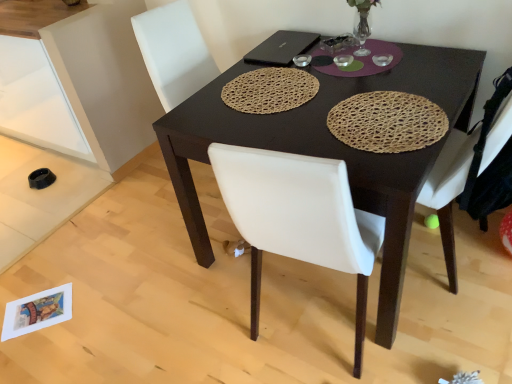
The height and width of the screenshot is (384, 512). Describe the element at coordinates (471, 169) in the screenshot. I see `white leather chair at right` at that location.

Find the location of a particular element. Image resolution: width=512 pixels, height=384 pixels. woven straw placemat at center, the 2th mat when ordered from left to right is located at coordinates [x=387, y=122].

Describe the element at coordinates (36, 79) in the screenshot. I see `matte white cabinet at lower left` at that location.

This screenshot has width=512, height=384. Identify the location of dark brown wooden desk at center. (329, 149).

The width and height of the screenshot is (512, 384). What are the coordinates of `cabinetry behind the white leather chair at right` in the screenshot? It's located at coord(36,79).

Between matte white cabinet at lower left and white leather chair at right, which one appears on the right side from the viewer's perspective?

Positioned to the right is white leather chair at right.

Is white leather chair at right inside matte white cabinet at lower left?

Actually, white leather chair at right is outside matte white cabinet at lower left.

Considering the relative sizes of matte white cabinet at lower left and white leather chair at right in the image provided, is matte white cabinet at lower left thinner than white leather chair at right?

In fact, matte white cabinet at lower left might be wider than white leather chair at right.

Considering the positions of point (313, 97) and point (433, 182), is point (313, 97) closer or farther from the camera than point (433, 182)?

Clearly, point (313, 97) is more distant from the camera than point (433, 182).

Looking at this image, can you confirm if woven brown placemat at center, the 2th mat from the right, is thinner than white leather chair at right?

Yes.

Is woven brown placemat at center, the 1th mat positioned from the left, to the left or to the right of white leather chair at right in the image?

Based on their positions, woven brown placemat at center, the 1th mat positioned from the left, is located to the left of white leather chair at right.

Is there a large distance between matte white cabinet at lower left and woven straw placemat at center, marked as the first mat in a right-to-left arrangement?

Yes, matte white cabinet at lower left is far from woven straw placemat at center, marked as the first mat in a right-to-left arrangement.

Is matte white cabinet at lower left spatially inside woven straw placemat at center, marked as the first mat in a right-to-left arrangement, or outside of it?

matte white cabinet at lower left is not inside woven straw placemat at center, marked as the first mat in a right-to-left arrangement, it's outside.

Is matte white cabinet at lower left positioned behind woven straw placemat at center, marked as the first mat in a right-to-left arrangement?

Yes, the depth of matte white cabinet at lower left is greater than that of woven straw placemat at center, marked as the first mat in a right-to-left arrangement.

From a real-world perspective, is matte white cabinet at lower left over woven straw placemat at center, marked as the first mat in a right-to-left arrangement?

Incorrect, from a real-world perspective, matte white cabinet at lower left is lower than woven straw placemat at center, marked as the first mat in a right-to-left arrangement.

From the image's perspective, which one is positioned lower, woven brown placemat at center, the 1th mat positioned from the left, or woven straw placemat at center, the 2th mat when ordered from left to right?

woven straw placemat at center, the 2th mat when ordered from left to right, from the image's perspective.

From the picture: Is woven brown placemat at center, the 1th mat positioned from the left, turned away from woven straw placemat at center, marked as the first mat in a right-to-left arrangement?

That's not correct — woven brown placemat at center, the 1th mat positioned from the left, is not looking away from woven straw placemat at center, marked as the first mat in a right-to-left arrangement.

Are woven brown placemat at center, the 2th mat from the right, and woven straw placemat at center, the 2th mat when ordered from left to right, beside each other?

They are not placed beside each other.

Based on the photo, do you think woven brown placemat at center, the 1th mat positioned from the left, is within woven straw placemat at center, the 2th mat when ordered from left to right, or outside of it?

woven brown placemat at center, the 1th mat positioned from the left, is located beyond the bounds of woven straw placemat at center, the 2th mat when ordered from left to right.

Does point (33, 93) come behind point (301, 44)?

Yes, point (33, 93) is behind point (301, 44).

Does matte white cabinet at lower left have a lesser width compared to black matte laptop at upper center?

In fact, matte white cabinet at lower left might be wider than black matte laptop at upper center.

Is black matte laptop at upper center at the back of matte white cabinet at lower left?

No, black matte laptop at upper center is not at the back of matte white cabinet at lower left.

Can you confirm if matte white cabinet at lower left is bigger than black matte laptop at upper center?

Correct, matte white cabinet at lower left is larger in size than black matte laptop at upper center.

Does point (391, 157) appear closer or farther from the camera than point (464, 140)?

Clearly, point (391, 157) is closer to the camera than point (464, 140).

Is dark brown wooden desk at center to the left or to the right of white leather chair at right in the image?

From the image, it's evident that dark brown wooden desk at center is to the left of white leather chair at right.

From the image's perspective, is dark brown wooden desk at center over white leather chair at right?

No, from the image's perspective, dark brown wooden desk at center is not above white leather chair at right.

Considering the sizes of dark brown wooden desk at center and white leather chair at right in the image, is dark brown wooden desk at center bigger or smaller than white leather chair at right?

Considering their sizes, dark brown wooden desk at center takes up more space than white leather chair at right.

Considering their positions, is black matte laptop at upper center located in front of or behind matte white cabinet at lower left?

black matte laptop at upper center is positioned closer to the viewer than matte white cabinet at lower left.

Considering the points (271, 58) and (46, 14), which point is behind, point (271, 58) or point (46, 14)?

The point (46, 14) is behind.

Where is `cabinetry directly beneath the black matte laptop at upper center (from a real-world perspective)`? This screenshot has height=384, width=512. cabinetry directly beneath the black matte laptop at upper center (from a real-world perspective) is located at coordinates (36, 79).

Considering the sizes of objects black matte laptop at upper center and matte white cabinet at lower left in the image provided, who is shorter, black matte laptop at upper center or matte white cabinet at lower left?

Standing shorter between the two is black matte laptop at upper center.

You are a GUI agent. You are given a task and a screenshot of the screen. Output one action in this format:
    pyautogui.click(x=<x>, y=<y>)
    Task: Click on the cabinetry behind the white leather chair at right
    
    Given the screenshot: What is the action you would take?
    pyautogui.click(x=36, y=79)

Starting from the white leather chair at right, which mat is the 2nd one to the left? Please provide its 2D coordinates.

[(270, 90)]

Based on their spatial positions, is black matte laptop at upper center or woven straw placemat at center, the 2th mat when ordered from left to right, further from dark brown wooden desk at center?

black matte laptop at upper center.

Based on their spatial positions, is woven straw placemat at center, marked as the first mat in a right-to-left arrangement, or matte white cabinet at lower left closer to black matte laptop at upper center?

woven straw placemat at center, marked as the first mat in a right-to-left arrangement, is closer to black matte laptop at upper center.

Looking at the image, which one is located further to woven brown placemat at center, the 1th mat positioned from the left, black matte laptop at upper center or dark brown wooden desk at center?

Among the two, dark brown wooden desk at center is located further to woven brown placemat at center, the 1th mat positioned from the left.

When comparing their distances from dark brown wooden desk at center, does matte white cabinet at lower left or woven straw placemat at center, the 2th mat when ordered from left to right, seem further?

Among the two, matte white cabinet at lower left is located further to dark brown wooden desk at center.

Considering their positions, is matte white cabinet at lower left positioned further to woven brown placemat at center, the 2th mat from the right, than dark brown wooden desk at center?

matte white cabinet at lower left is positioned further to the anchor woven brown placemat at center, the 2th mat from the right.

Looking at the image, which one is located further to white leather chair at right, black matte laptop at upper center or matte white cabinet at lower left?

The object further to white leather chair at right is matte white cabinet at lower left.

Considering their positions, is matte white cabinet at lower left positioned further to woven brown placemat at center, the 2th mat from the right, than white leather chair at right?

Among the two, matte white cabinet at lower left is located further to woven brown placemat at center, the 2th mat from the right.

From the image, which object appears to be nearer to woven brown placemat at center, the 1th mat positioned from the left, woven straw placemat at center, marked as the first mat in a right-to-left arrangement, or matte white cabinet at lower left?

woven straw placemat at center, marked as the first mat in a right-to-left arrangement, is closer to woven brown placemat at center, the 1th mat positioned from the left.

Locate an element on the screen. mat between matte white cabinet at lower left and dark brown wooden desk at center from left to right is located at coordinates (270, 90).

The height and width of the screenshot is (384, 512). Find the location of `desk situated between woven brown placemat at center, the 2th mat from the right, and woven straw placemat at center, the 2th mat when ordered from left to right, from left to right`. desk situated between woven brown placemat at center, the 2th mat from the right, and woven straw placemat at center, the 2th mat when ordered from left to right, from left to right is located at coordinates tap(329, 149).

Find the location of a particular element. The width and height of the screenshot is (512, 384). mat situated between matte white cabinet at lower left and black matte laptop at upper center from left to right is located at coordinates (x=270, y=90).

The width and height of the screenshot is (512, 384). What are the coordinates of `desk located between woven brown placemat at center, the 2th mat from the right, and white leather chair at right in the left-right direction` in the screenshot? It's located at (329, 149).